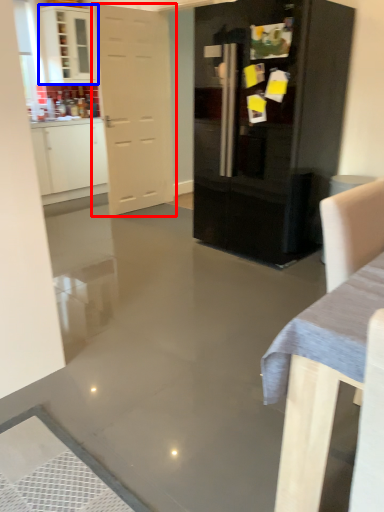
Question: Among these objects, which one is farthest to the camera, door (highlighted by a red box) or cabinetry (highlighted by a blue box)?

Choices:
 (A) door
 (B) cabinetry

Answer: (B)